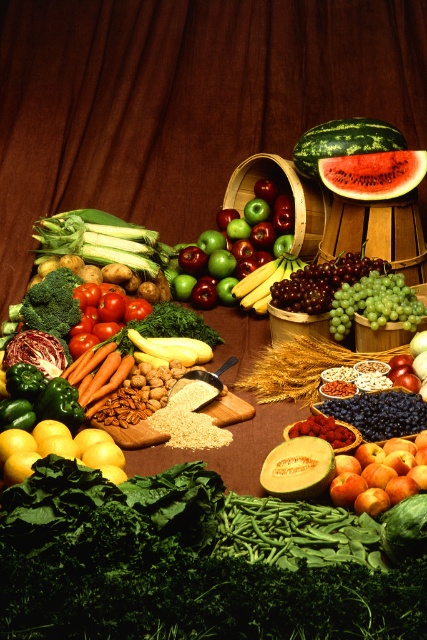
You are arranging fruits on a brown wooden table at center and a watermelon at center. Which object is positioned higher?

The brown wooden table at center is located above the watermelon at center, so it is positioned higher.

You are standing in front of the wooden surface where the fruits and vegetables are arranged. What are the coordinates of the brown wooden table at center?

The brown wooden table at center is located at coordinates point (183, 100).

You are a chef preparing a meal and need to place the watermelon at center on the brown wooden table at center. Can you fit the watermelon on the table considering their sizes?

The brown wooden table at center is much taller than the watermelon at center, so the watermelon can be placed on the table since height difference won